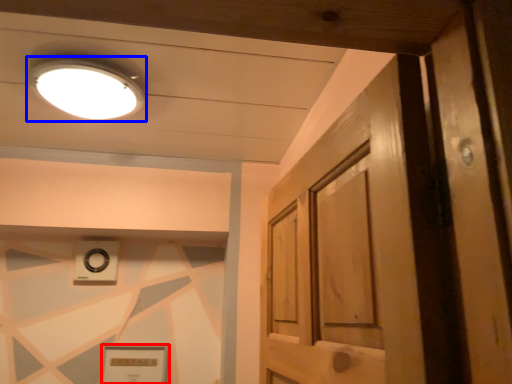
Question: Which point is further to the camera, picture frame (highlighted by a red box) or lighting (highlighted by a blue box)?

Choices:
 (A) picture frame
 (B) lighting

Answer: (A)